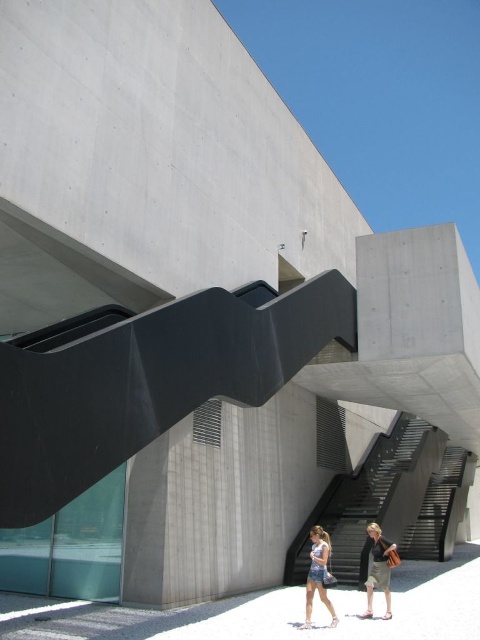
You are standing at the entrance of the building and see the black textured stairs at center and the light brown sandal at lower right. Which object is closer to you?

The light brown sandal at lower right is closer to you because the black textured stairs at center is positioned under it, indicating the sandal is above and nearer in the scene.

You are a photographer standing in front of the modern building. You notice the denim shorts at center and the light brown sandal at lower right. Based on their positions, which object is closer to the photographer?

The denim shorts at center is above the light brown sandal at lower right, so the denim shorts at center is closer to the photographer.